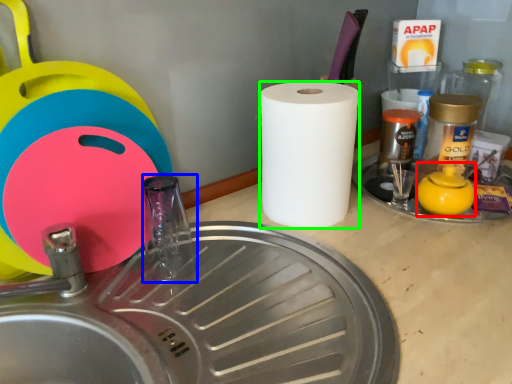
Question: Based on their relative distances, which object is farther from tea pot (highlighted by a red box)? Choose from faucet (highlighted by a blue box) and paper towel (highlighted by a green box).

Choices:
 (A) faucet
 (B) paper towel

Answer: (A)